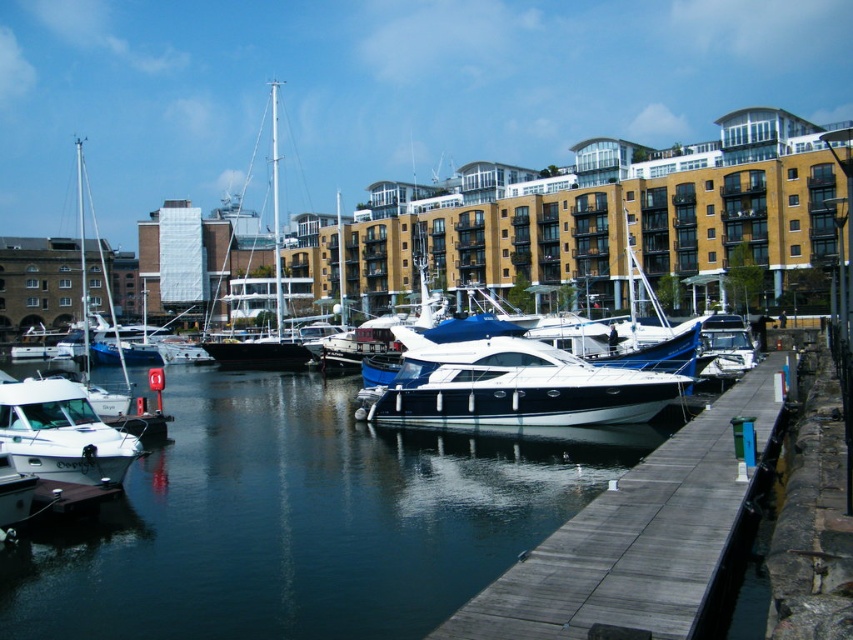
You are a photographer planning to capture the entire scene of the marina. You notice the glossy water at center and the shiny white sailboat at center. Which object takes up more space in the image?

The shiny white sailboat at center takes up more space than the glossy water at center in the image.

You are a photographer planning to capture a wide shot of the marina. You notice two boats in your frame, the wooden at center and the shiny white sailboat at center. Which boat appears narrower in the photo?

The wooden at center appears narrower than the shiny white sailboat at center in the photo.